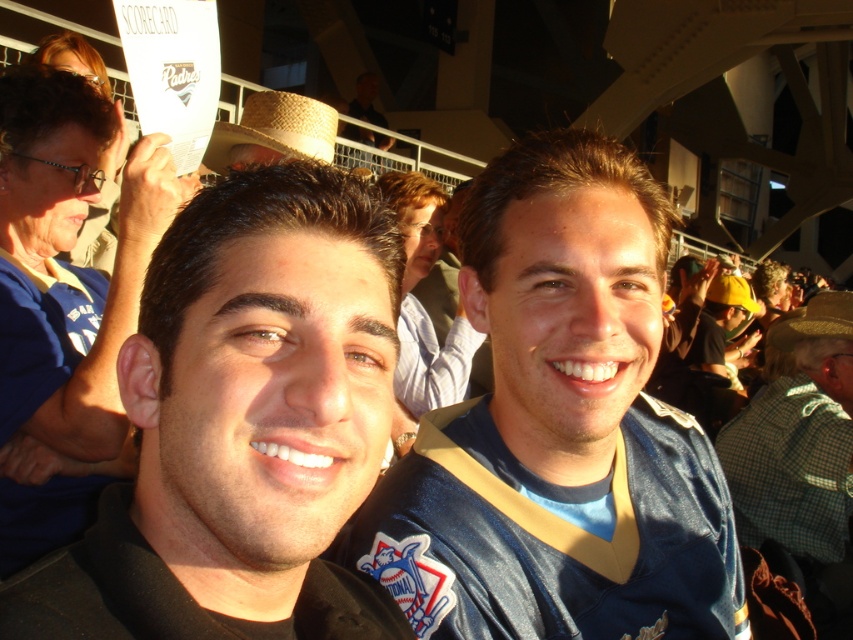
You are standing in the baseball stadium and see two points marked in the image. Which point is closer to you, point (570, 488) or point (287, 147)?

Point (570, 488) is closer to the viewer than point (287, 147).

You are at a baseball game and want to locate the blue shiny jersey at center and the strawhat at upper center. According to the scene, which object is positioned to the right of the other?

The blue shiny jersey at center is to the right of the strawhat at upper center.